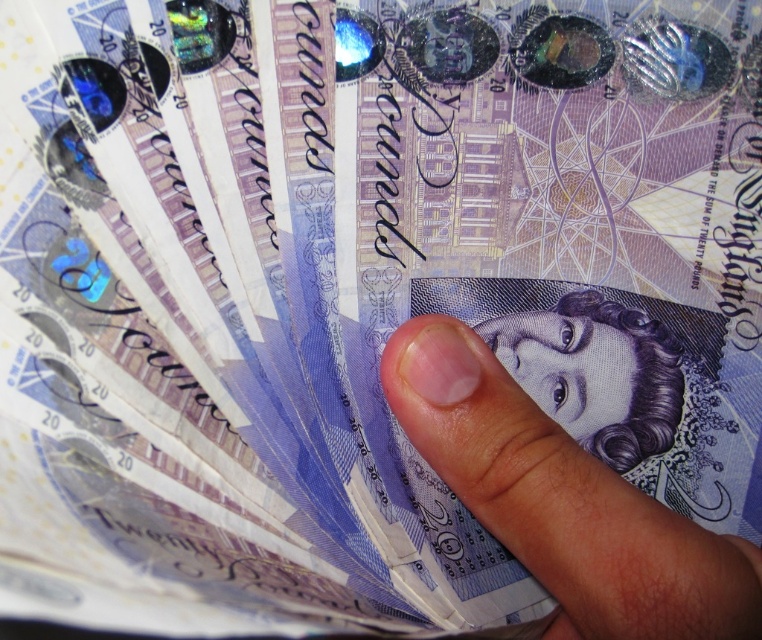
From the picture: Between flesh-toned skin at center and purple paper money at center, which one has less height?

Standing shorter between the two is purple paper money at center.

Looking at this image, does flesh-toned skin at center have a greater width compared to purple paper money at center?

Yes, flesh-toned skin at center is wider than purple paper money at center.

Does point (487, 424) come behind point (511, 314)?

No, it is in front of (511, 314).

Where is `flesh-toned skin at center`? The width and height of the screenshot is (762, 640). flesh-toned skin at center is located at coordinates (562, 500).